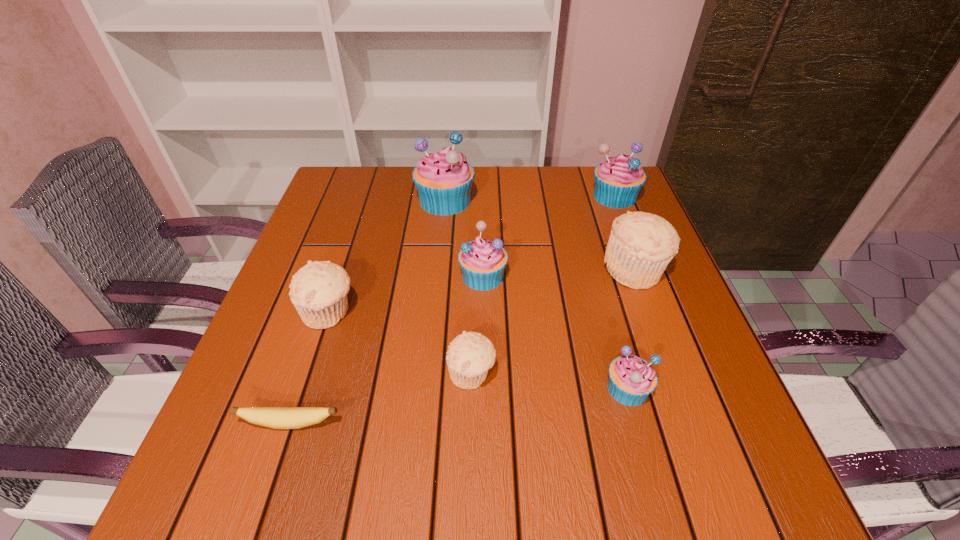
Image resolution: width=960 pixels, height=540 pixels. What are the coordinates of `the smallest beige muffin` in the screenshot? It's located at (470, 355).

The width and height of the screenshot is (960, 540). What are the coordinates of `the nearest object` in the screenshot? It's located at (274, 417).

Locate an element on the screen. The image size is (960, 540). banana is located at coordinates (274, 417).

At what (x,y) coordinates should I click in order to perform the action: click on free space located on the left of the tallest object. Please return your answer as a coordinate pair (x, y). This screenshot has height=540, width=960. Looking at the image, I should click on (372, 200).

The width and height of the screenshot is (960, 540). Find the location of `free region located on the left of the rightmost blue muffin`. free region located on the left of the rightmost blue muffin is located at coordinates (504, 196).

This screenshot has height=540, width=960. Identify the location of free space located 0.100m on the back of the rightmost beige muffin. (617, 224).

Locate an element on the screen. This screenshot has height=540, width=960. vacant area situated 0.190m on the right of the third biggest blue muffin is located at coordinates (590, 275).

This screenshot has width=960, height=540. I want to click on vacant space located on the right of the leftmost beige muffin, so click(457, 312).

This screenshot has height=540, width=960. Identify the location of free space located 0.220m on the left of the third blue muffin from left to right. (482, 388).

Find the location of `vacant space located 0.060m on the front of the second beige muffin from right to left`. vacant space located 0.060m on the front of the second beige muffin from right to left is located at coordinates (470, 426).